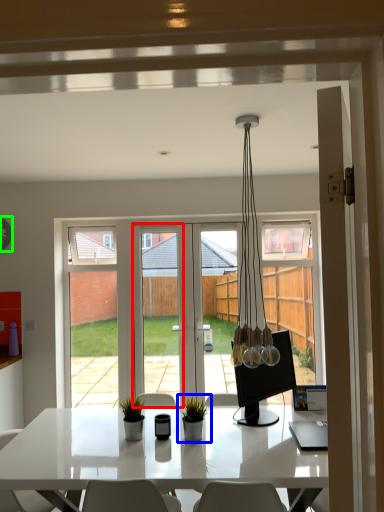
Question: Considering the real-world distances, which object is closest to screen door (highlighted by a red box)? houseplant (highlighted by a blue box) or clock (highlighted by a green box).

Choices:
 (A) houseplant
 (B) clock

Answer: (B)